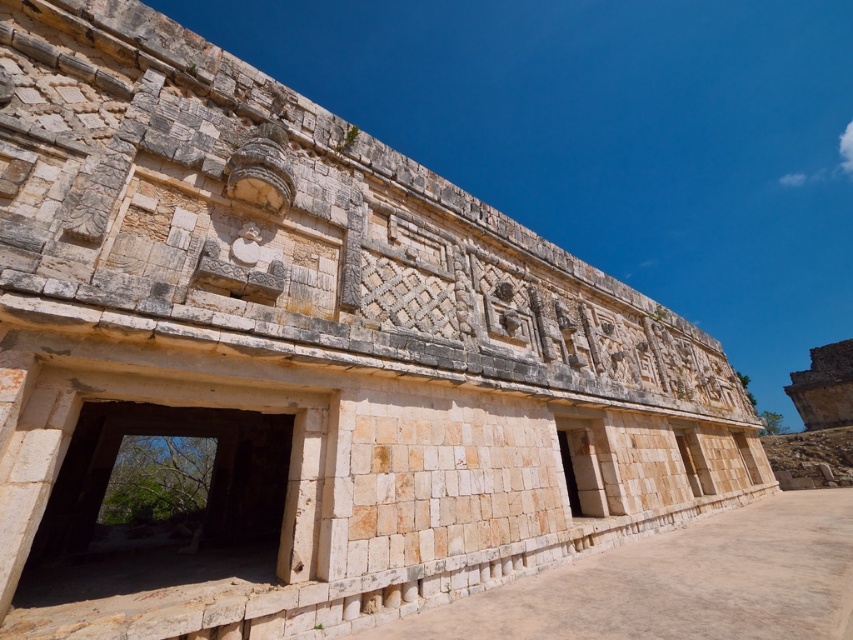
You are an archaeologist examining the ancient stone structure. You notice the light beige stone archway at center and the light beige stone door at center. Which of these two objects is bigger in size?

The light beige stone archway at center is larger in size compared to the light beige stone door at center.

You are an archaeologist examining the ancient stone structure. You notice the light beige stone archway at center and the light beige stone door at center. Which one is located to the left of the other?

The light beige stone archway at center is positioned on the left side of the light beige stone door at center.